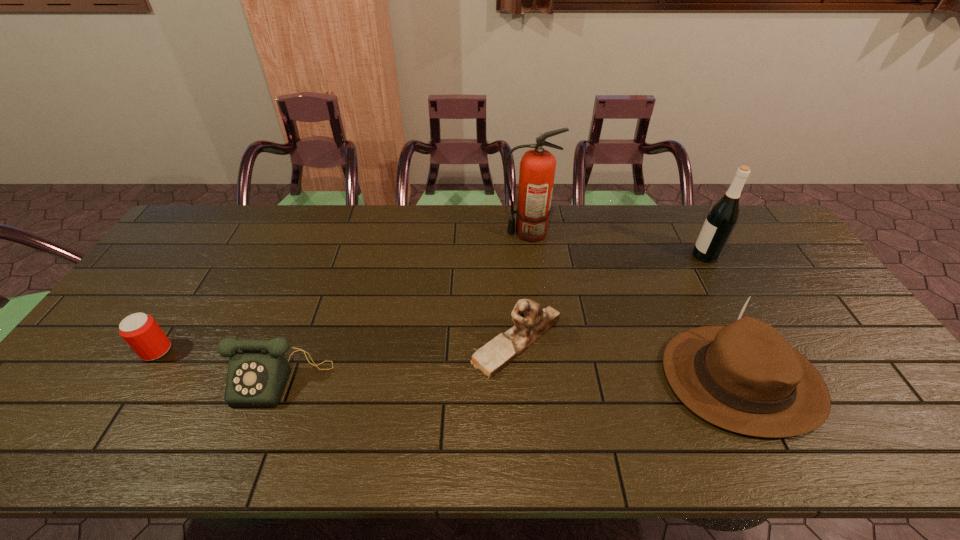
Locate an element on the screen. vacant area at the far right corner is located at coordinates (748, 240).

The image size is (960, 540). What are the coordinates of `vacant space in between the telephone and the second farthest object` in the screenshot? It's located at (493, 316).

The image size is (960, 540). In order to click on free space between the fifth object from right to left and the fifth shortest object in this screenshot , I will do `click(493, 316)`.

What are the coordinates of `free space between the second farthest object and the tallest object` in the screenshot? It's located at (616, 244).

Where is `vacant space in between the second tallest object and the figurine`? vacant space in between the second tallest object and the figurine is located at coordinates (611, 299).

Find the location of a particular element. free space between the figurine and the leftmost object is located at coordinates (336, 346).

Identify the location of vacant space that is in between the figurine and the tallest object. The width and height of the screenshot is (960, 540). (522, 287).

Image resolution: width=960 pixels, height=540 pixels. I want to click on unoccupied position between the beer can and the fifth shortest object, so click(431, 303).

You are a GUI agent. You are given a task and a screenshot of the screen. Output one action in this format:
    pyautogui.click(x=<x>, y=<y>)
    Task: Click on the vacant point located between the leftmost object and the second object from left to right
    The width and height of the screenshot is (960, 540).
    Given the screenshot: What is the action you would take?
    pyautogui.click(x=219, y=364)

At what (x,y) coordinates should I click in order to perform the action: click on vacant space that is in between the wine bottle and the third tallest object. Please return your answer as a coordinate pair (x, y). Looking at the image, I should click on (724, 317).